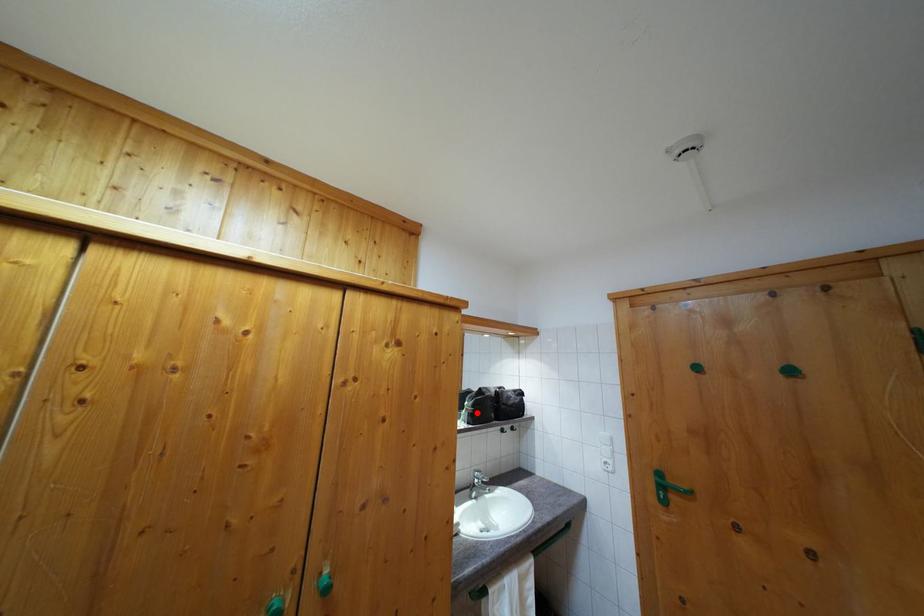
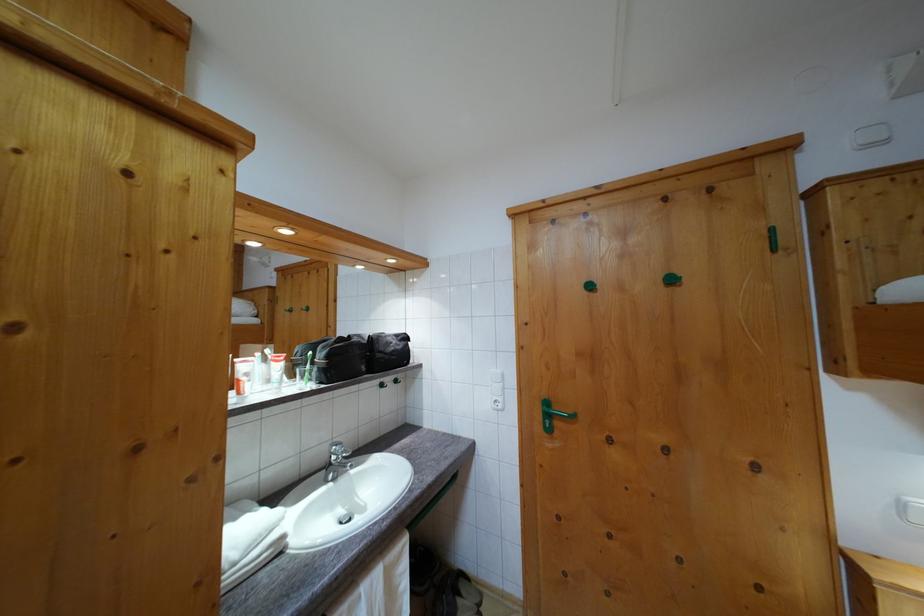
In the second image, find the point that corresponds to the highlighted location in the first image.

(332, 363)